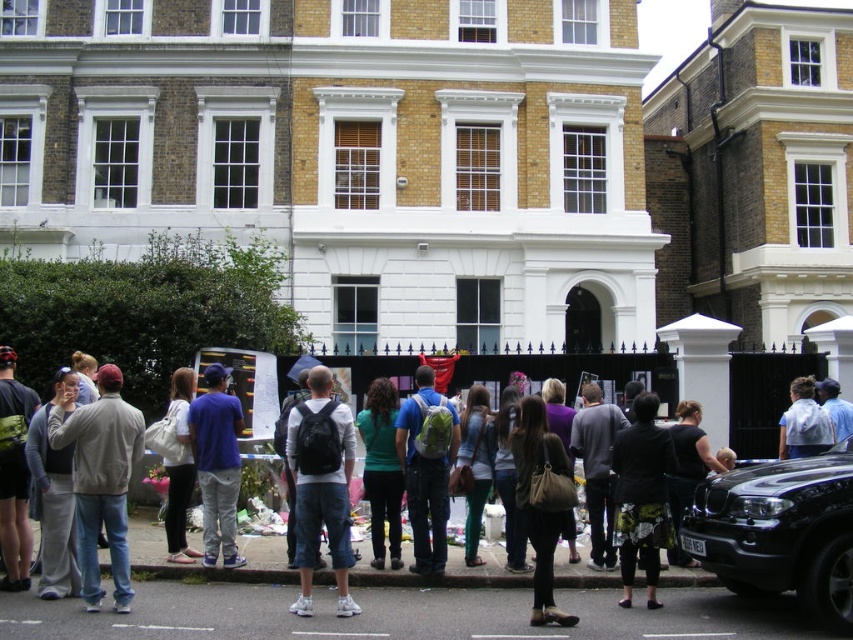
You are a photographer taking a picture of the memorial scene. You want to capture both the blue fabric cap at center and the white plastic bag at center in the frame. Which object should you adjust your focus to ensure both are visible, considering their positions?

Since the white plastic bag at center is behind the blue fabric cap at center, you should focus on the white plastic bag at center to ensure both objects are in focus as the blue fabric cap at center is in front of it.